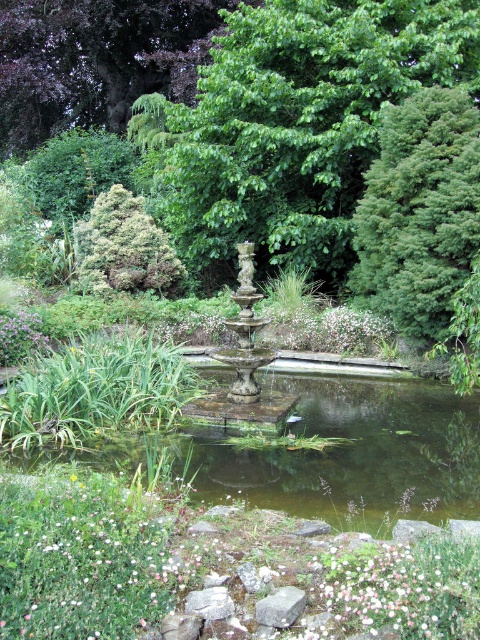
You are a gardener who needs to place a 2.5 meter long hose between the green textured bush at upper right and the gray rock at center. Is the distance sufficient to allow the hose to reach from one to the other without moving either object?

The distance between the green textured bush at upper right and the gray rock at center is 6.44 meters. Since the hose is only 2.5 meters long, it is not long enough to span the distance between them. You would need a longer hose or move one of the objects closer.

You are planning to place a small garden ornament that requires a base area of 0.5 square meters. Given the green textured bush at upper right and the gray rock at center, which object would provide a suitable location for placing the ornament based on their size?

The green textured bush at upper right is larger in size than the gray rock at center, so it can provide a suitable location for placing the ornament since it has a larger base area.

You are standing in the garden and want to place a small statue exactly at the center of the fountain. The green textured bush at upper left is at coordinates point 0.388, 0.258. Can you determine the direction you need to walk from the bush to reach the center of the fountain?

The green textured bush at upper left is located at point (123, 248). To reach the center of the fountain, you would need to move towards the lower right direction from the bush since the fountain is centrally positioned in the scene.